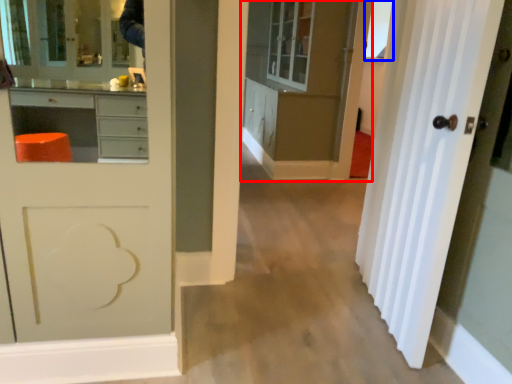
Question: Which of the following is the closest to the observer, cabinetry (highlighted by a red box) or window (highlighted by a blue box)?

Choices:
 (A) cabinetry
 (B) window

Answer: (A)